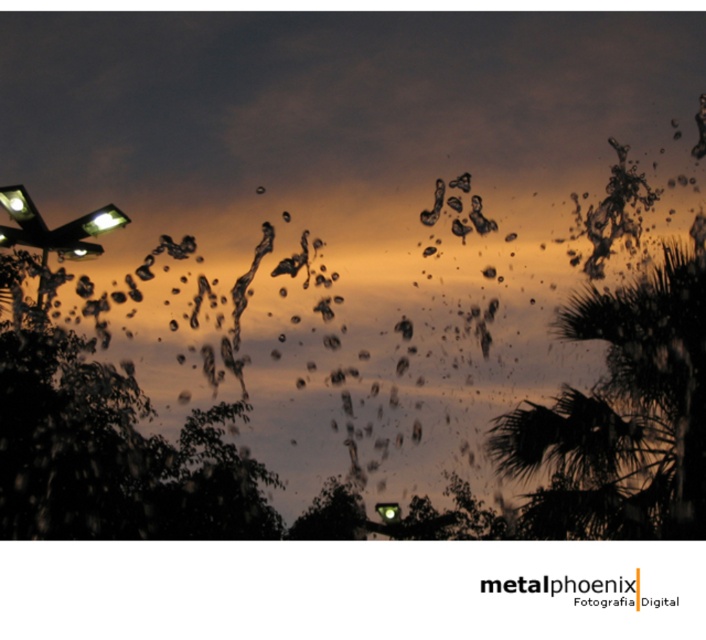
Question: Is translucent glass bird at upper center thinner than metallic shiny bird at center?

Choices:
 (A) yes
 (B) no

Answer: (B)

Question: Does translucent glass bird at upper center appear under green glass traffic light at center?

Choices:
 (A) no
 (B) yes

Answer: (A)

Question: Which object appears closest to the camera in this image?

Choices:
 (A) metallic shiny bird at center
 (B) green glass traffic light at center
 (C) translucent glass bird at upper center

Answer: (A)

Question: Is green leafy palm tree at center closer to the viewer compared to translucent glass bird at upper center?

Choices:
 (A) yes
 (B) no

Answer: (A)

Question: Which object is positioned closest to the green leafy palm tree at center?

Choices:
 (A) translucent glass bird at upper center
 (B) metallic shiny bird at center
 (C) green glass traffic light at center

Answer: (B)

Question: Which point appears farthest from the camera in this image?

Choices:
 (A) (496, 225)
 (B) (436, 202)
 (C) (388, 522)

Answer: (C)